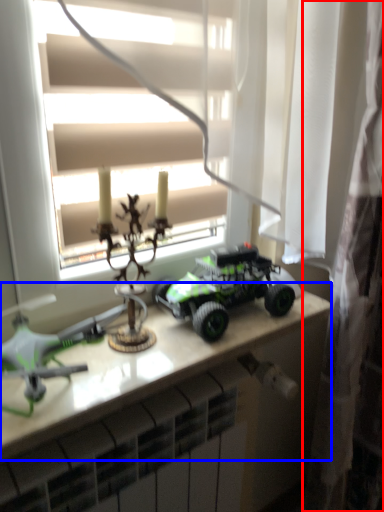
Question: Which object is closer to the camera taking this photo, curtain (highlighted by a red box) or table (highlighted by a blue box)?

Choices:
 (A) curtain
 (B) table

Answer: (B)